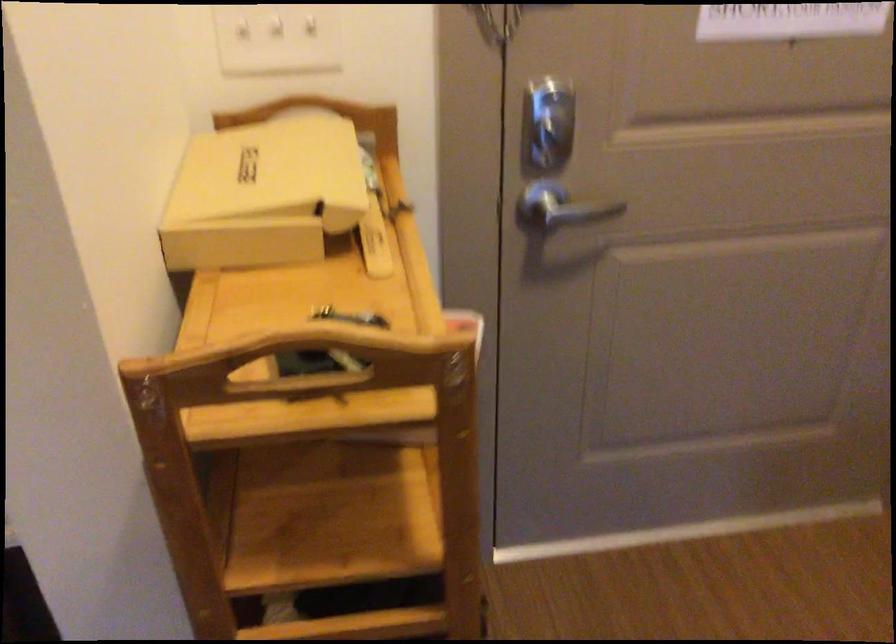
Where would you lift the beige remote control? Please return your answer as a coordinate pair (x, y).

(375, 242)